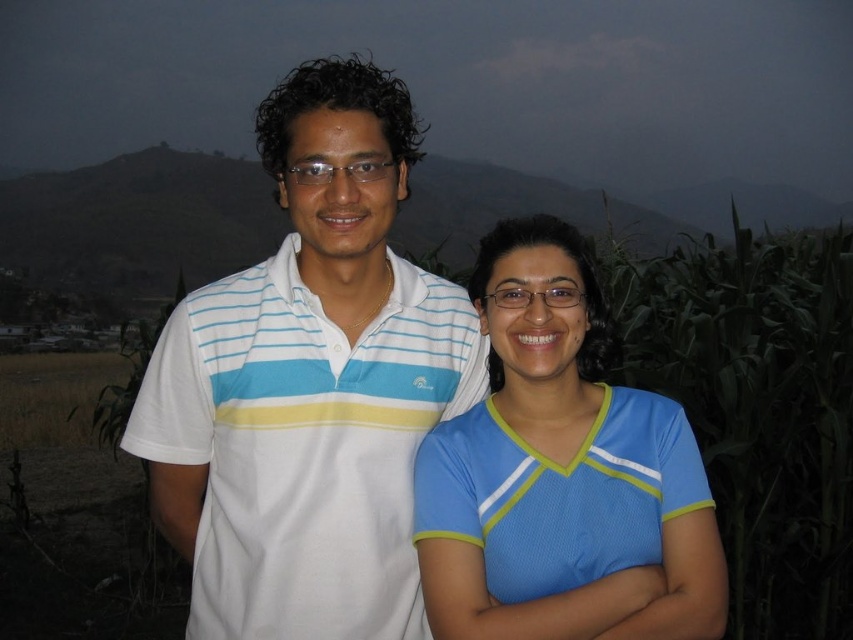
Does white striped polo shirt at center appear over blue mesh shirt at center?

Yes, white striped polo shirt at center is above blue mesh shirt at center.

Between white striped polo shirt at center and blue mesh shirt at center, which one is positioned higher?

white striped polo shirt at center

The image size is (853, 640). Describe the element at coordinates (309, 385) in the screenshot. I see `white striped polo shirt at center` at that location.

Identify the location of white striped polo shirt at center. (309, 385).